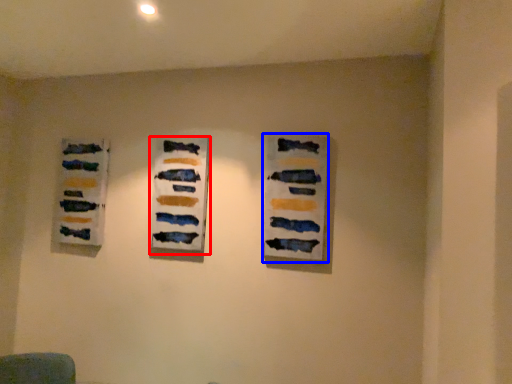
Question: Which of the following is the closest to the observer, art exhibition (highlighted by a red box) or art exhibition (highlighted by a blue box)?

Choices:
 (A) art exhibition
 (B) art exhibition

Answer: (B)